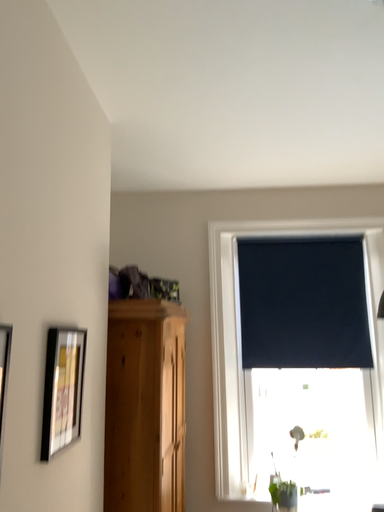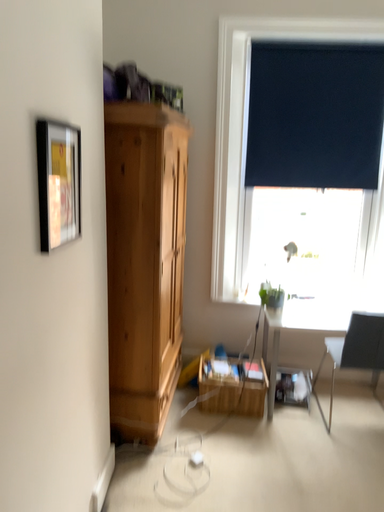
Question: How did the camera likely rotate when shooting the video?

Choices:
 (A) rotated downward
 (B) rotated upward

Answer: (A)